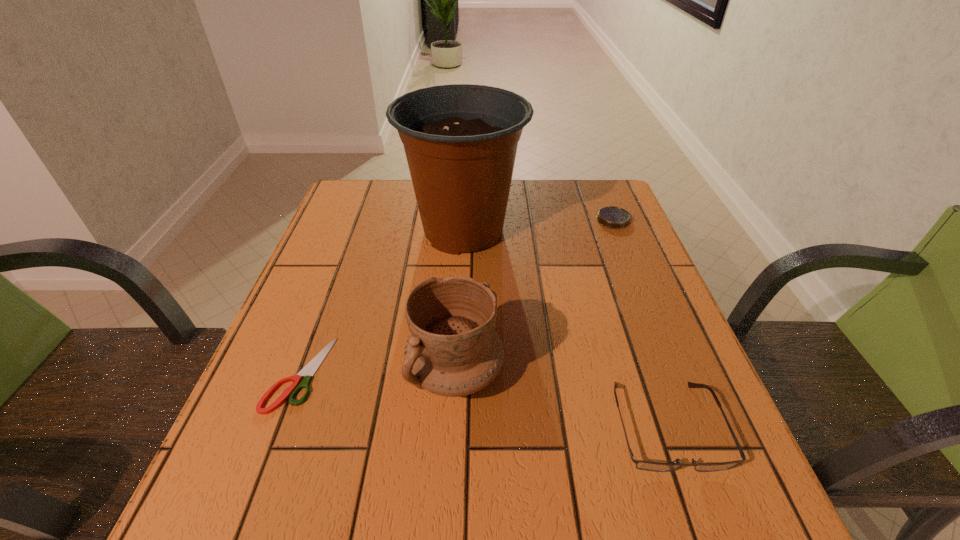
Where is `free spot at the near left corner of the desktop`? The width and height of the screenshot is (960, 540). free spot at the near left corner of the desktop is located at coordinates (221, 489).

At what (x,y) coordinates should I click in order to perform the action: click on vacant point at the near right corner. Please return your answer as a coordinate pair (x, y). Looking at the image, I should click on (750, 484).

Identify the location of vacant space that's between the tallest object and the scissors. (381, 302).

The height and width of the screenshot is (540, 960). I want to click on blank region between the shortest object and the tallest object, so click(x=381, y=302).

Locate an element on the screen. This screenshot has width=960, height=540. unoccupied area between the compass and the tallest object is located at coordinates (539, 226).

This screenshot has height=540, width=960. I want to click on vacant space that is in between the compass and the fourth shortest object, so click(x=535, y=296).

This screenshot has width=960, height=540. Identify the location of empty space that is in between the second tallest object and the compass. (535, 296).

Find the location of a particular element. This screenshot has height=540, width=960. free space between the flowerpot and the shortest object is located at coordinates (381, 302).

At what (x,y) coordinates should I click in order to perform the action: click on vacant space that is in between the tallest object and the scissors. Please return your answer as a coordinate pair (x, y). Looking at the image, I should click on (381, 302).

The width and height of the screenshot is (960, 540). I want to click on the third closest object to the fourth shortest object, so click(x=460, y=140).